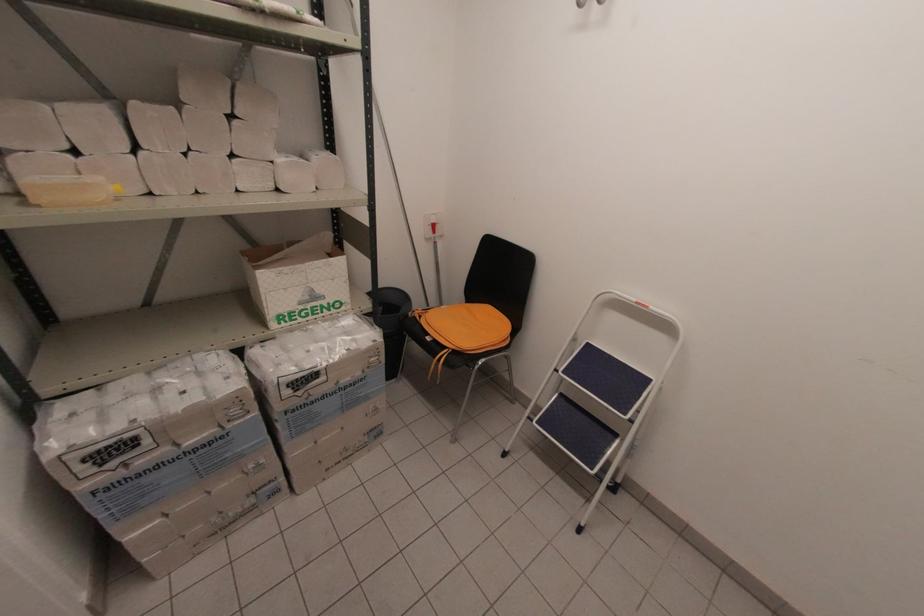
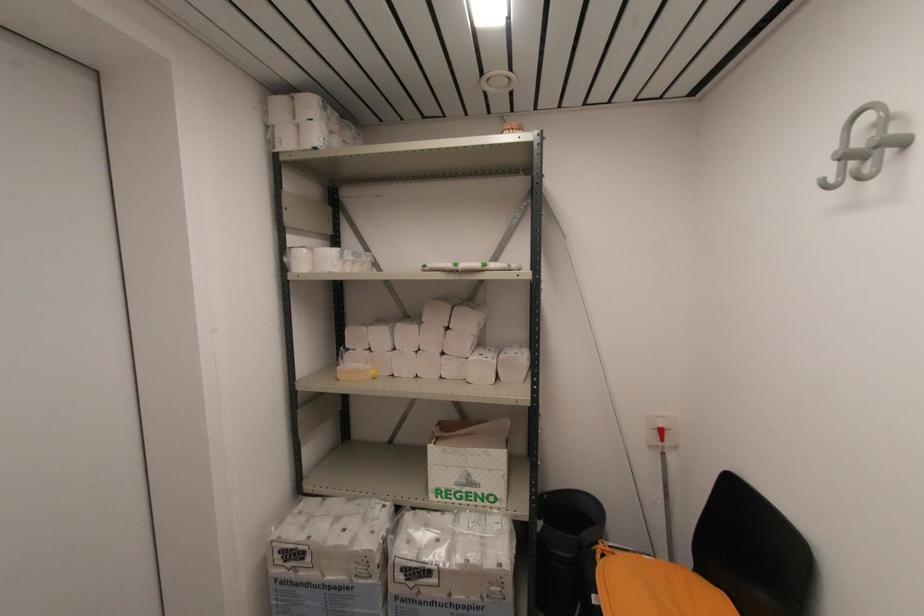
Find the pixel in the second image that matches point (428, 313) in the first image.

(614, 554)